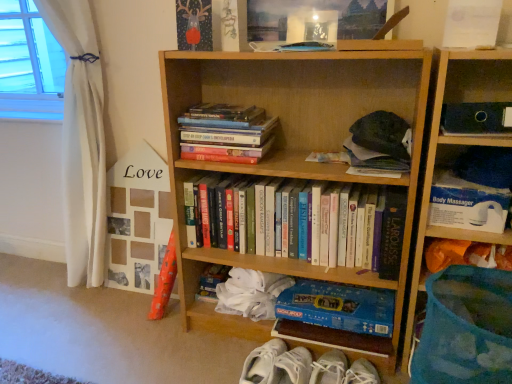
Find the location of `free space above white plastic body massager at upper right (from a real-world perspective)`. free space above white plastic body massager at upper right (from a real-world perspective) is located at coordinates (478, 198).